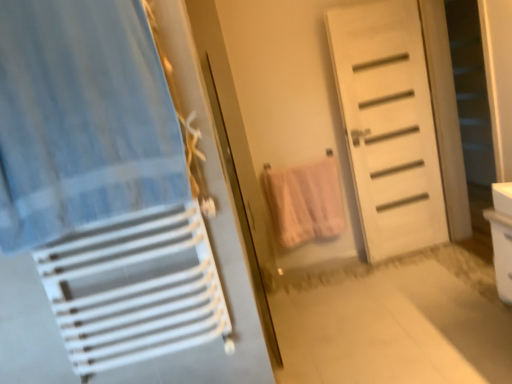
Question: Considering the positions of blue striped fabric at left and white plastic drawer at right in the image, is blue striped fabric at left bigger or smaller than white plastic drawer at right?

Choices:
 (A) big
 (B) small

Answer: (A)

Question: Is blue striped fabric at left inside or outside of white plastic drawer at right?

Choices:
 (A) inside
 (B) outside

Answer: (B)

Question: Which is nearer to the white matte door at center?

Choices:
 (A) blue striped fabric at left
 (B) white plastic drawer at right
 (C) white matte screen door at right
 (D) pink cotton towel at center

Answer: (D)

Question: Which object is the closest to the white matte screen door at right?

Choices:
 (A) pink cotton towel at center
 (B) white plastic drawer at right
 (C) blue striped fabric at left
 (D) white matte door at center

Answer: (D)